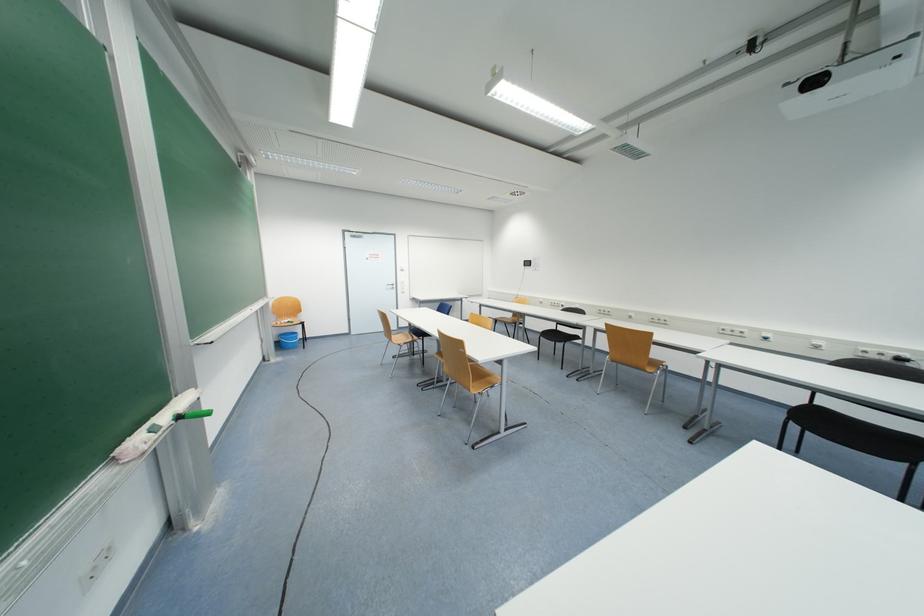
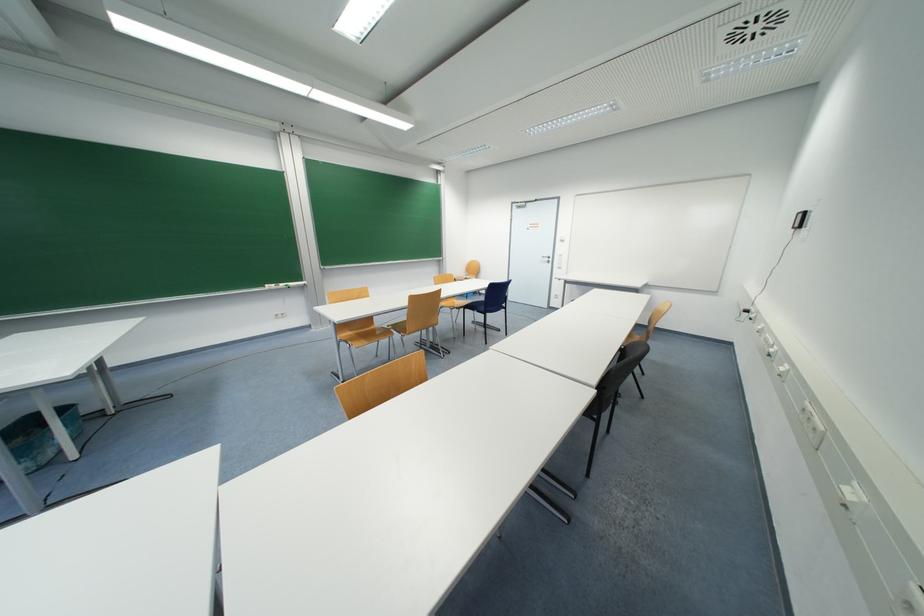
Question: I am providing you with two images of the same scene from different viewpoints. After the viewpoint changes to image2, which objects are now occluded?

Choices:
 (A) white electrical plug
 (B) grey sandal
 (C) white board eraser
 (D) blue plastic bucket

Answer: (D)